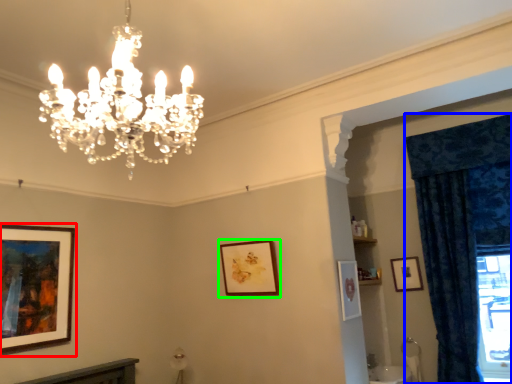
Question: Estimate the real-world distances between objects in this image. Which object is closer to picture frame (highlighted by a red box), curtain (highlighted by a blue box) or picture frame (highlighted by a green box)?

Choices:
 (A) curtain
 (B) picture frame

Answer: (B)